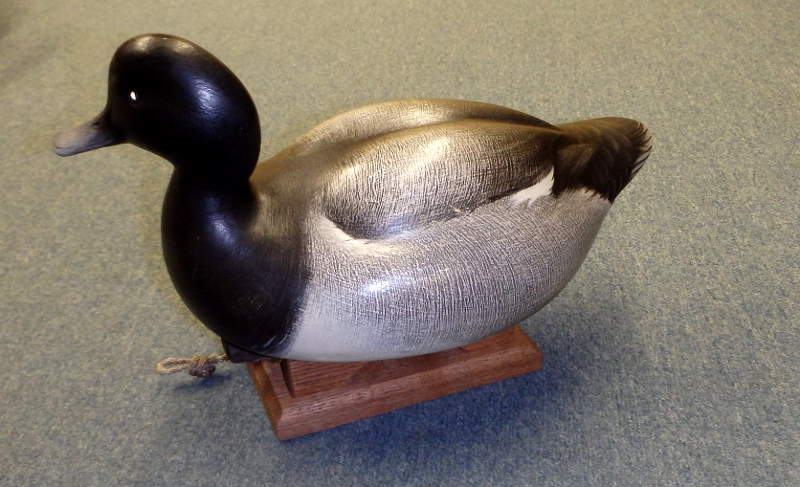
Where is `stand`? The image size is (800, 487). stand is located at coordinates (390, 380).